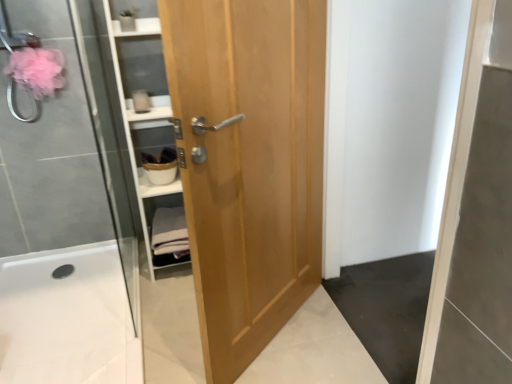
Question: Does white cotton towels at center appear on the right side of light brown wood door at center?

Choices:
 (A) yes
 (B) no

Answer: (B)

Question: Does white cotton towels at center have a larger size compared to light brown wood door at center?

Choices:
 (A) no
 (B) yes

Answer: (A)

Question: Is white cotton towels at center to the left of light brown wood door at center from the viewer's perspective?

Choices:
 (A) no
 (B) yes

Answer: (B)

Question: Is white cotton towels at center closer to camera compared to light brown wood door at center?

Choices:
 (A) yes
 (B) no

Answer: (B)

Question: Would you say white cotton towels at center is a long distance from light brown wood door at center?

Choices:
 (A) no
 (B) yes

Answer: (A)

Question: Considering the positions of white cotton towels at center and light brown wood door at center in the image, is white cotton towels at center bigger or smaller than light brown wood door at center?

Choices:
 (A) big
 (B) small

Answer: (B)

Question: Is white cotton towels at center wider or thinner than light brown wood door at center?

Choices:
 (A) wide
 (B) thin

Answer: (A)

Question: Is white cotton towels at center inside or outside of light brown wood door at center?

Choices:
 (A) inside
 (B) outside

Answer: (B)

Question: In terms of height, does white cotton towels at center look taller or shorter compared to light brown wood door at center?

Choices:
 (A) tall
 (B) short

Answer: (B)

Question: From a real-world perspective, is white glossy bath at lower left above or below white cotton towels at center?

Choices:
 (A) above
 (B) below

Answer: (B)

Question: Choose the correct answer: Is white glossy bath at lower left inside white cotton towels at center or outside it?

Choices:
 (A) outside
 (B) inside

Answer: (A)

Question: From the image's perspective, is white glossy bath at lower left located above or below white cotton towels at center?

Choices:
 (A) above
 (B) below

Answer: (B)

Question: Is white glossy bath at lower left wider or thinner than white cotton towels at center?

Choices:
 (A) wide
 (B) thin

Answer: (A)

Question: Based on their positions, is white glossy bath at lower left located to the left or right of light brown wood door at center?

Choices:
 (A) right
 (B) left

Answer: (B)

Question: From the image's perspective, is white glossy bath at lower left located above or below light brown wood door at center?

Choices:
 (A) below
 (B) above

Answer: (A)